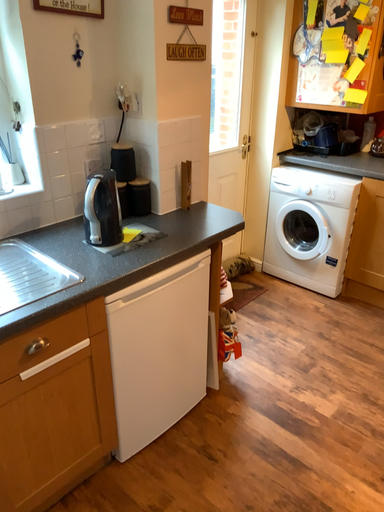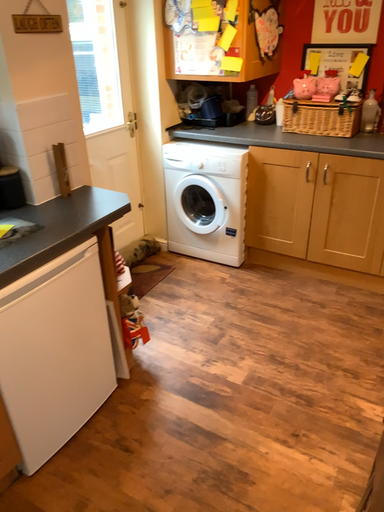
Question: Which way did the camera rotate in the video?

Choices:
 (A) rotated right
 (B) rotated left

Answer: (A)